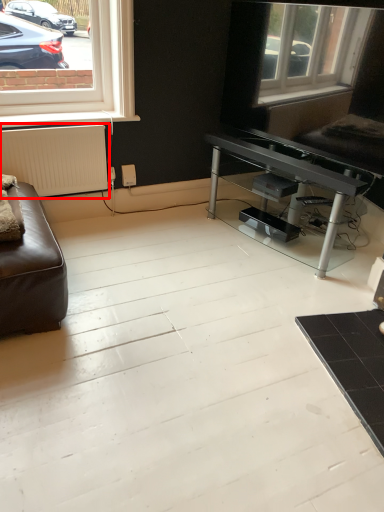
Question: From the image's perspective, where is radiator (annotated by the red box) located relative to table?

Choices:
 (A) below
 (B) above

Answer: (B)